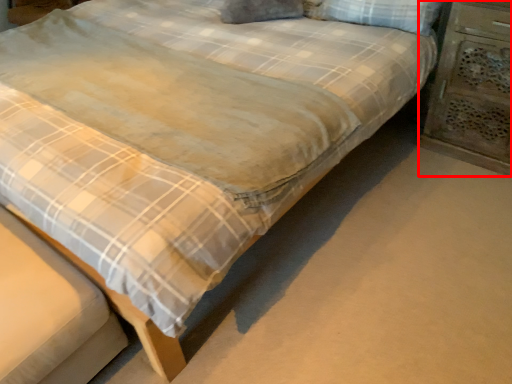
Question: Considering the relative positions of nightstand (annotated by the red box) and pillow in the image provided, where is nightstand (annotated by the red box) located with respect to the staircase?

Choices:
 (A) left
 (B) right

Answer: (B)